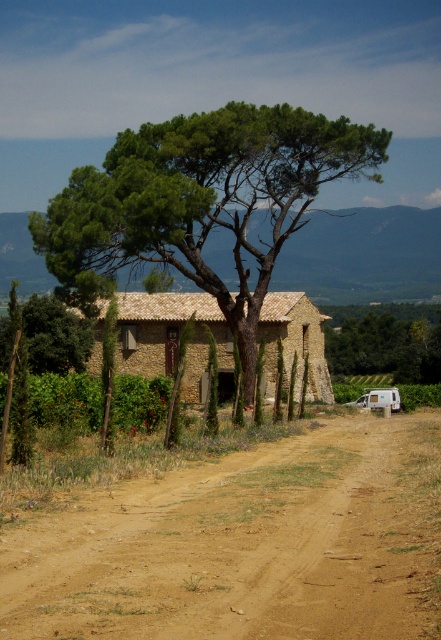
Between brown dirt track at center and green leafy tree at left, which one has less height?

brown dirt track at center

Does brown dirt track at center have a greater width compared to green leafy tree at left?

In fact, brown dirt track at center might be narrower than green leafy tree at left.

You are a GUI agent. You are given a task and a screenshot of the screen. Output one action in this format:
    pyautogui.click(x=<x>, y=<y>)
    Task: Click on the brown dirt track at center
    This screenshot has width=441, height=640.
    Given the screenshot: What is the action you would take?
    pyautogui.click(x=243, y=545)

Does brown stone house at center appear on the left side of green leafy tree at upper center?

Indeed, brown stone house at center is positioned on the left side of green leafy tree at upper center.

The image size is (441, 640). In order to click on brown stone house at center in this screenshot , I will do `click(168, 336)`.

Does point (321, 394) come in front of point (410, 333)?

Yes, point (321, 394) is in front of point (410, 333).

Image resolution: width=441 pixels, height=640 pixels. I want to click on brown stone house at center, so click(168, 336).

Measure the distance between point (179,627) and camera.

6.53 meters

Does brown dirt track at center have a greater height compared to brown stone house at center?

Incorrect, brown dirt track at center's height is not larger of brown stone house at center's.

Between point (164, 608) and point (183, 301), which one is positioned in front?

Point (164, 608) is more forward.

The width and height of the screenshot is (441, 640). In order to click on brown dirt track at center in this screenshot , I will do `click(243, 545)`.